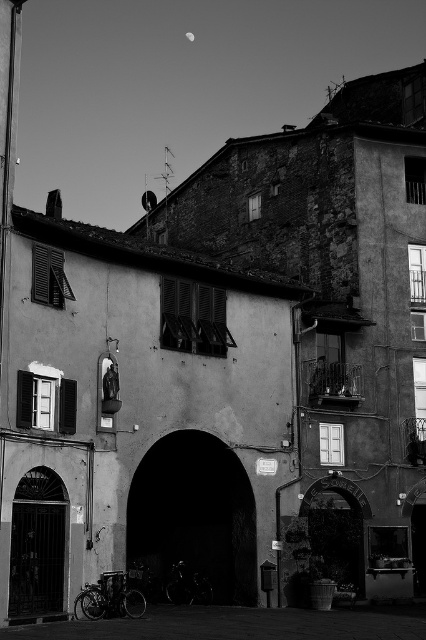
You are standing in the middle of the smooth concrete alley at lower center and want to exit through the dark stone archway at center. Which direction should you head to reach the archway?

Answer: The dark stone archway at center is to the left of the smooth concrete alley at lower center, so you should head to the left to reach the archway.

You are a city planner analyzing this urban scene. You need to determine which area is larger in the image between the dark stone archway at center and the smooth concrete alley at lower center. Which one takes up more space?

The smooth concrete alley at lower center takes up more space than the dark stone archway at center because the dark stone archway at center occupies less space than smooth concrete alley at lower center.

You are a delivery person trying to navigate through the dark stone archway at center and the smooth concrete alley at lower center. Which path is wider for your delivery truck?

The smooth concrete alley at lower center is wider than the dark stone archway at center, so the delivery truck should take the smooth concrete alley at lower center.